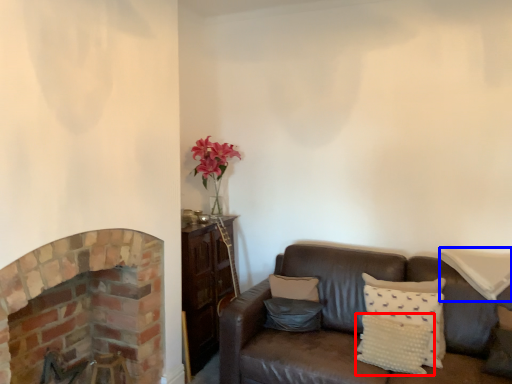
Question: Which point is closer to the camera, pillow (highlighted by a red box) or pillow (highlighted by a blue box)?

Choices:
 (A) pillow
 (B) pillow

Answer: (A)